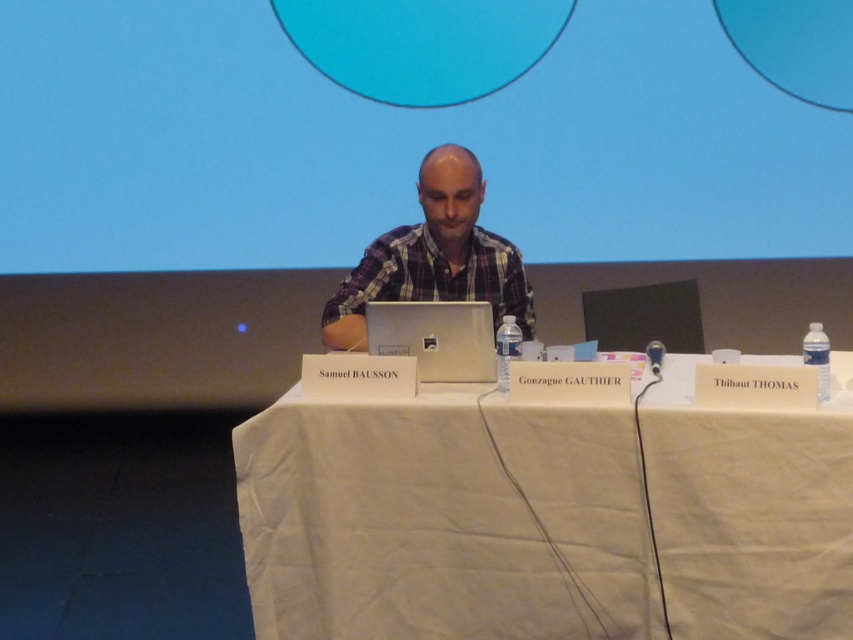
You are an attendee at this event and need to look at the blue matte projection screen at upper center while also checking notes on the white cloth table at center. Which object will you need to look towards first to see the projection screen?

The blue matte projection screen at upper center is further to the viewer than the white cloth table at center, so you would need to look towards the blue matte projection screen at upper center first before looking down at the white cloth table at center.